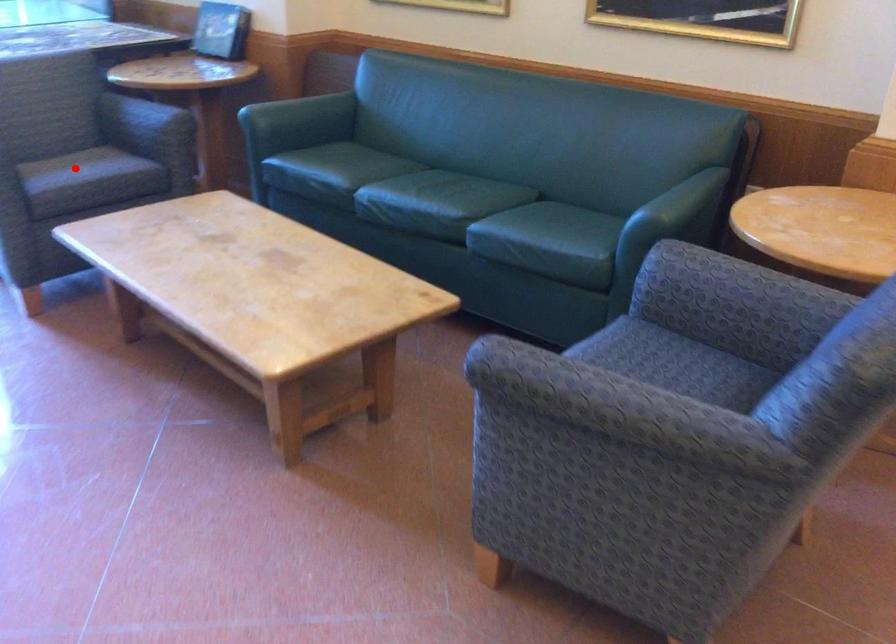
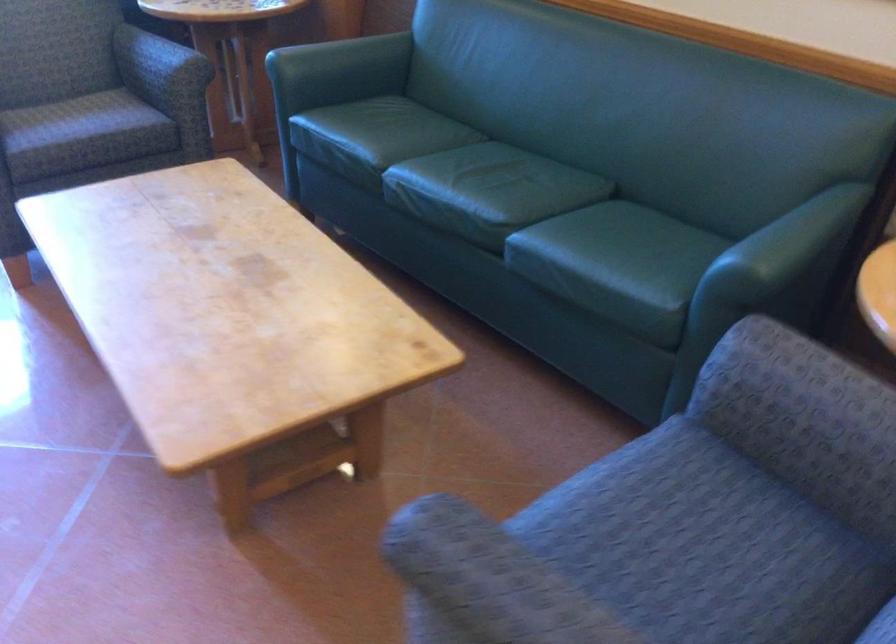
Where in the second image is the point corresponding to the highlighted location from the first image?

(65, 118)